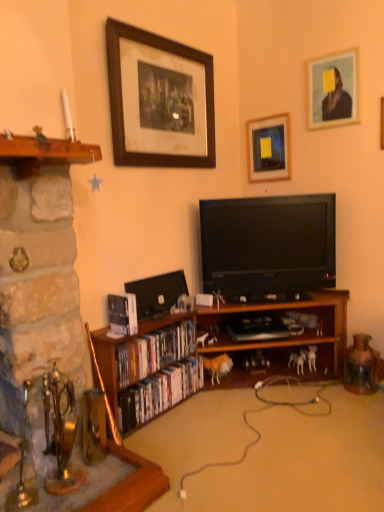
Where is `empty space that is to the right of brown fur figurine at lower center, which ranks as the second animal in right-to-left order`? empty space that is to the right of brown fur figurine at lower center, which ranks as the second animal in right-to-left order is located at coordinates (240, 392).